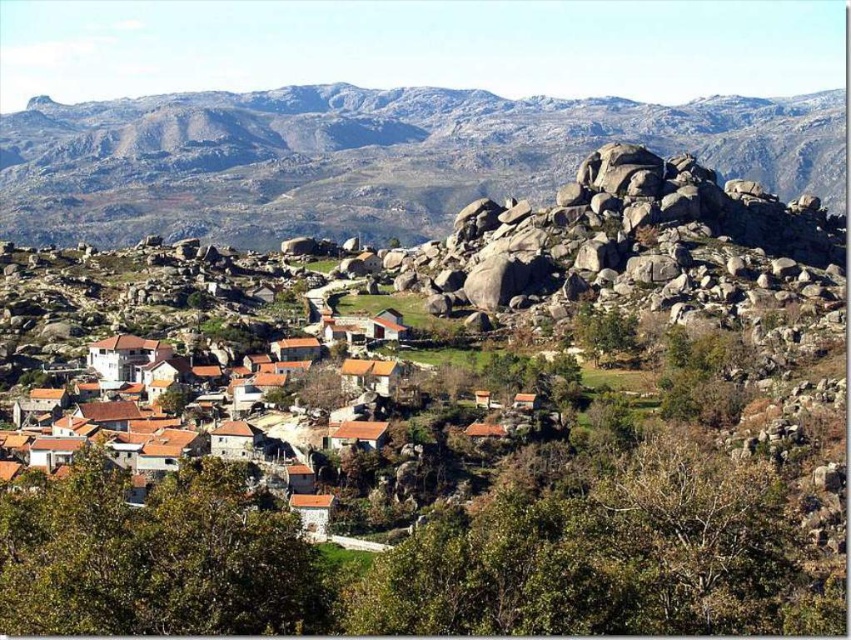
Looking at this image, you are a hiker standing in the village and want to reach the distant hills beyond the rocky terrain. According to the image, which direction should you move relative to the brown clay houses at center to avoid the granite boulders at upper center?

The granite boulders at upper center are on the right side of the brown clay houses at center, so to avoid them, you should move to the left side of the brown clay houses at center towards the direction opposite the granite boulders.